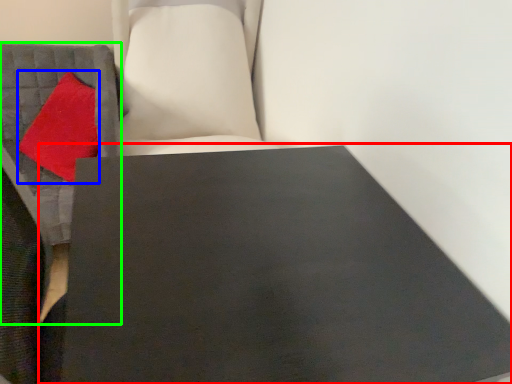
Question: Which object is the farthest from table (highlighted by a red box)? Choose among these: throw pillow (highlighted by a blue box) or furniture (highlighted by a green box).

Choices:
 (A) throw pillow
 (B) furniture

Answer: (A)